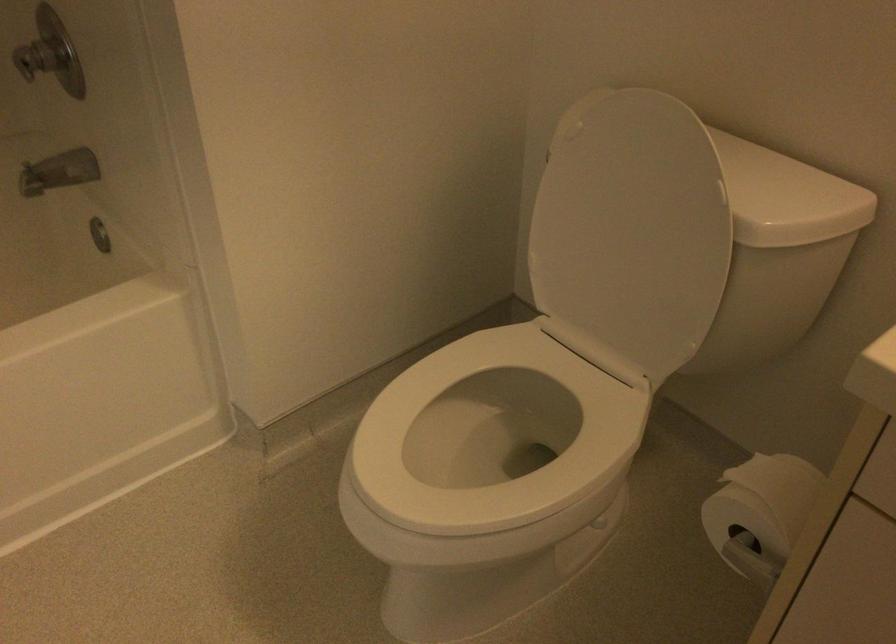
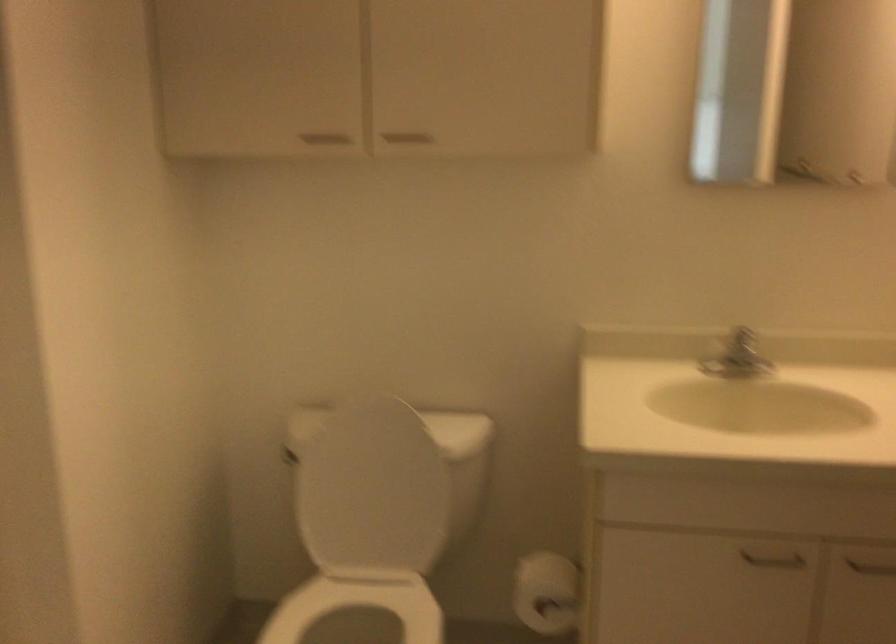
The point at (556, 377) is marked in the first image. Where is the corresponding point in the second image?

(357, 605)